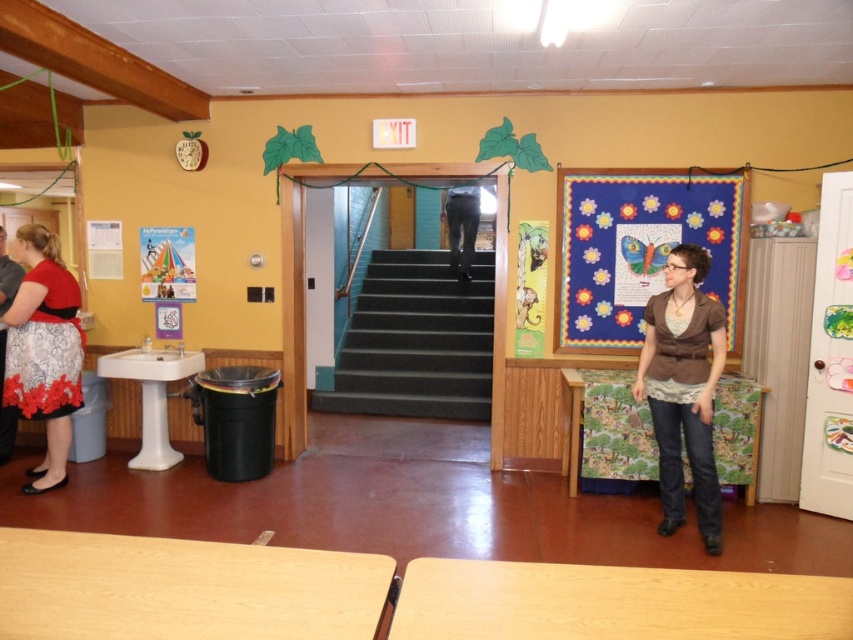
You are standing in the scene and want to place a small potted plant exactly at the center of the image. The multicolored fabric butterfly at right is currently at point 0.391, 0.749. Will the butterfly be directly to the left or right of the potted plant?

The multicolored fabric butterfly at right is located at coordinates (637, 250). Since the center of the image is at (426, 320), the butterfly is to the left of the center point. Therefore, placing the potted plant at the center would result in the butterfly being to the left of the potted plant.

In the scene shown: You are a tailor who needs to adjust the length of the brown fabric shirt at center and black jeans at center. Which clothing item requires a shorter hem to match their current proportions?

The brown fabric shirt at center is much taller than the black jeans at center, so the brown fabric shirt at center needs to be shortened to match the length of the black jeans at center.

You are an interior designer planning to place a new decorative item in the space. The multicolored fabric butterfly at right and the black jeans at center are already present. Which object has a greater width?

The multicolored fabric butterfly at right has a greater width than the black jeans at center.